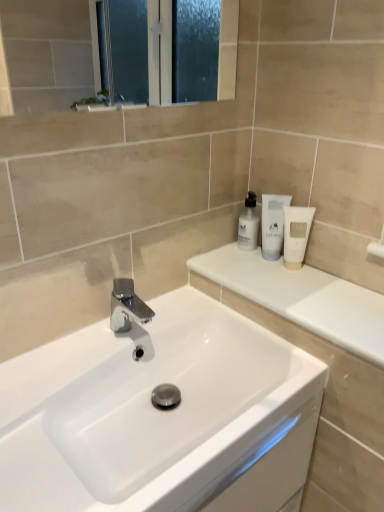
Question: Is white matte tube at upper right, placed as the first toiletry when sorted from right to left, in front of white glossy sink at center?

Choices:
 (A) yes
 (B) no

Answer: (B)

Question: Considering the relative sizes of white matte tube at upper right, placed as the first toiletry when sorted from right to left, and white glossy sink at center in the image provided, is white matte tube at upper right, placed as the first toiletry when sorted from right to left, bigger than white glossy sink at center?

Choices:
 (A) yes
 (B) no

Answer: (B)

Question: Is white matte tube at upper right, placed as the first toiletry when sorted from right to left, to the left of white glossy sink at center from the viewer's perspective?

Choices:
 (A) yes
 (B) no

Answer: (B)

Question: Does white matte tube at upper right, placed as the first toiletry when sorted from right to left, have a smaller size compared to white glossy sink at center?

Choices:
 (A) no
 (B) yes

Answer: (B)

Question: Is white matte tube at upper right, placed as the first toiletry when sorted from right to left, with white glossy sink at center?

Choices:
 (A) no
 (B) yes

Answer: (A)

Question: Is polished chrome tap at center spatially inside white glossy countertop at upper right, or outside of it?

Choices:
 (A) outside
 (B) inside

Answer: (A)

Question: Looking at the image, does polished chrome tap at center seem bigger or smaller compared to white glossy countertop at upper right?

Choices:
 (A) big
 (B) small

Answer: (B)

Question: Considering the positions of polished chrome tap at center and white glossy countertop at upper right in the image, is polished chrome tap at center taller or shorter than white glossy countertop at upper right?

Choices:
 (A) short
 (B) tall

Answer: (B)

Question: From a real-world perspective, is polished chrome tap at center positioned above or below white glossy countertop at upper right?

Choices:
 (A) above
 (B) below

Answer: (B)

Question: Is polished chrome tap at center in front of or behind white glossy lotion at upper right, which is the 2th toiletry in right-to-left order, in the image?

Choices:
 (A) behind
 (B) front

Answer: (B)

Question: Considering the positions of polished chrome tap at center and white glossy lotion at upper right, arranged as the 2th toiletry when viewed from the left, in the image, is polished chrome tap at center bigger or smaller than white glossy lotion at upper right, arranged as the 2th toiletry when viewed from the left,?

Choices:
 (A) small
 (B) big

Answer: (B)

Question: From the image's perspective, is polished chrome tap at center positioned above or below white glossy lotion at upper right, arranged as the 2th toiletry when viewed from the left?

Choices:
 (A) below
 (B) above

Answer: (A)

Question: Looking at their shapes, would you say polished chrome tap at center is wider or thinner than white glossy lotion at upper right, which is the 2th toiletry in right-to-left order?

Choices:
 (A) wide
 (B) thin

Answer: (A)

Question: Does point (309, 210) appear closer or farther from the camera than point (241, 471)?

Choices:
 (A) farther
 (B) closer

Answer: (A)

Question: Would you say white matte tube at upper right, the third toiletry viewed from the left, is inside or outside white glossy sink at center?

Choices:
 (A) inside
 (B) outside

Answer: (B)